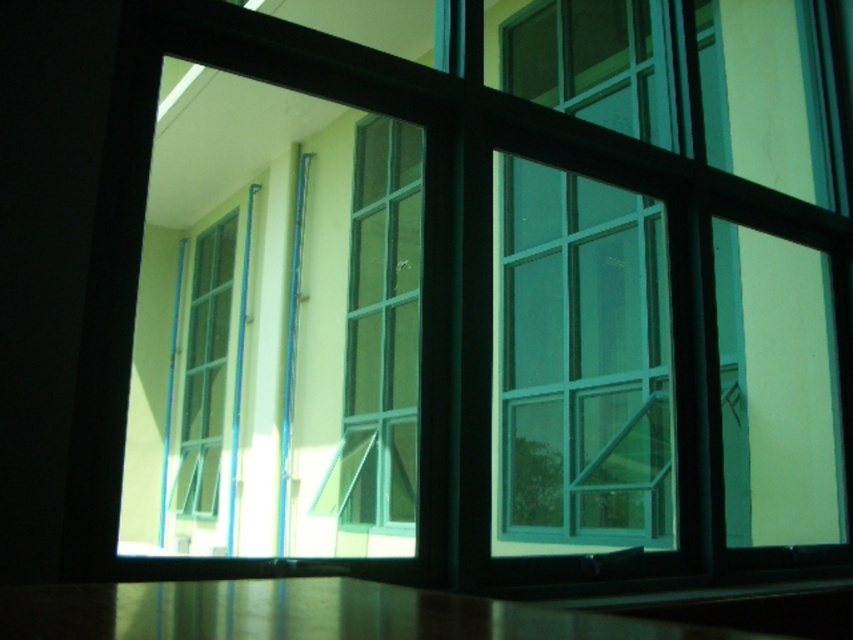
Which is more to the right, metallic polished table at lower center or clear glass window at center?

metallic polished table at lower center is more to the right.

Where is `metallic polished table at lower center`? The height and width of the screenshot is (640, 853). metallic polished table at lower center is located at coordinates (306, 612).

Locate an element on the screen. The height and width of the screenshot is (640, 853). metallic polished table at lower center is located at coordinates (306, 612).